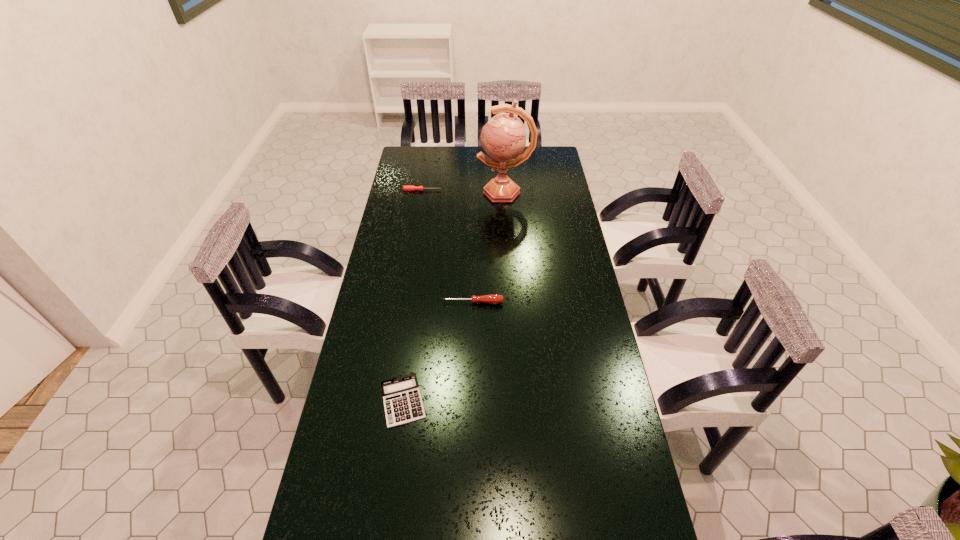
Where is `free space that satisfies the following two spatial constraints: 1. on the back side of the right screwdriver; 2. at the tip of the farther screwdriver`? This screenshot has width=960, height=540. free space that satisfies the following two spatial constraints: 1. on the back side of the right screwdriver; 2. at the tip of the farther screwdriver is located at coordinates (474, 190).

The image size is (960, 540). Find the location of `free space that satisfies the following two spatial constraints: 1. on the front-facing side of the globe; 2. on the front side of the third shortest object`. free space that satisfies the following two spatial constraints: 1. on the front-facing side of the globe; 2. on the front side of the third shortest object is located at coordinates (512, 302).

In order to click on vacant position in the image that satisfies the following two spatial constraints: 1. at the tip of the nearer screwdriver; 2. on the right side of the shorter screwdriver in this screenshot , I will do `click(404, 302)`.

The image size is (960, 540). Find the location of `vacant area in the image that satisfies the following two spatial constraints: 1. on the front-facing side of the globe; 2. on the front side of the calculator`. vacant area in the image that satisfies the following two spatial constraints: 1. on the front-facing side of the globe; 2. on the front side of the calculator is located at coordinates (518, 401).

At what (x,y) coordinates should I click in order to perform the action: click on vacant space that satisfies the following two spatial constraints: 1. at the tip of the right screwdriver; 2. on the left side of the left screwdriver. Please return your answer as a coordinate pair (x, y). Looking at the image, I should click on tap(404, 302).

Find the location of a particular element. This screenshot has height=540, width=960. vacant area in the image that satisfies the following two spatial constraints: 1. at the tip of the shorter screwdriver; 2. on the right side of the second nearest object is located at coordinates (404, 302).

Identify the location of free spot that satisfies the following two spatial constraints: 1. at the tip of the calculator; 2. on the right side of the shorter screwdriver. The height and width of the screenshot is (540, 960). pyautogui.click(x=388, y=401).